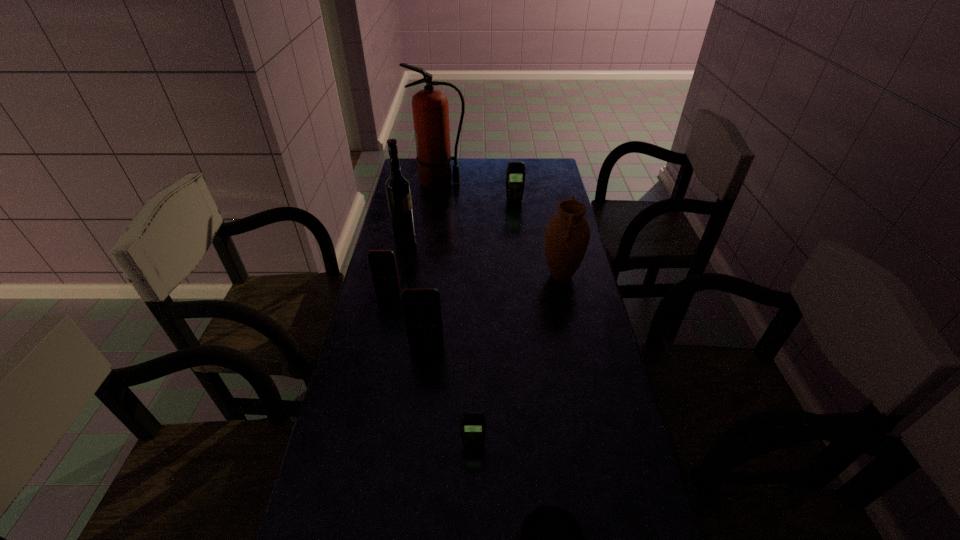
Where is `free space that satisfies the following two spatial constraints: 1. on the front and back of the third farthest object; 2. on the screen of the left orange cellular telephone`? free space that satisfies the following two spatial constraints: 1. on the front and back of the third farthest object; 2. on the screen of the left orange cellular telephone is located at coordinates (394, 294).

In order to click on vacant space that satisfies the following two spatial constraints: 1. on the back side of the rightmost object; 2. on the front and back of the seventh shortest object in this screenshot , I will do `click(554, 239)`.

Locate an element on the screen. The width and height of the screenshot is (960, 540). vacant region that satisfies the following two spatial constraints: 1. on the front and back of the sixth nearest object; 2. on the screen of the leftmost cellular telephone is located at coordinates (394, 294).

The image size is (960, 540). I want to click on free spot that satisfies the following two spatial constraints: 1. on the screen of the farthest cellular telephone; 2. on the front and back of the second tallest object, so click(518, 239).

Identify the location of free space that satisfies the following two spatial constraints: 1. on the screen of the rightmost cellular telephone; 2. on the front and back of the sixth nearest object. The height and width of the screenshot is (540, 960). (518, 239).